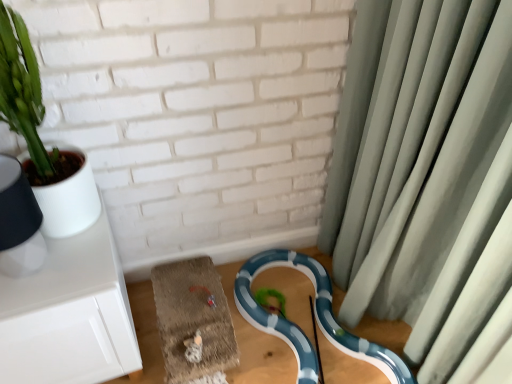
Question: From the image's perspective, does green fabric curtain at right appear higher than blue glossy snake at lower center?

Choices:
 (A) no
 (B) yes

Answer: (B)

Question: Does green fabric curtain at right come in front of blue glossy snake at lower center?

Choices:
 (A) yes
 (B) no

Answer: (A)

Question: Can you confirm if green fabric curtain at right is wider than blue glossy snake at lower center?

Choices:
 (A) yes
 (B) no

Answer: (B)

Question: From a real-world perspective, is green fabric curtain at right over blue glossy snake at lower center?

Choices:
 (A) no
 (B) yes

Answer: (B)

Question: Is green fabric curtain at right shorter than blue glossy snake at lower center?

Choices:
 (A) no
 (B) yes

Answer: (A)

Question: Is the depth of green fabric curtain at right greater than that of blue glossy snake at lower center?

Choices:
 (A) no
 (B) yes

Answer: (A)

Question: Can you confirm if green matte plant at upper left is taller than blue glossy snake at lower center?

Choices:
 (A) yes
 (B) no

Answer: (A)

Question: Is the position of green matte plant at upper left more distant than that of blue glossy snake at lower center?

Choices:
 (A) yes
 (B) no

Answer: (B)

Question: Does green matte plant at upper left have a smaller size compared to blue glossy snake at lower center?

Choices:
 (A) yes
 (B) no

Answer: (B)

Question: Considering the relative sizes of green matte plant at upper left and blue glossy snake at lower center in the image provided, is green matte plant at upper left thinner than blue glossy snake at lower center?

Choices:
 (A) yes
 (B) no

Answer: (A)

Question: Is green matte plant at upper left not inside blue glossy snake at lower center?

Choices:
 (A) yes
 (B) no

Answer: (A)

Question: Is green matte plant at upper left next to blue glossy snake at lower center?

Choices:
 (A) no
 (B) yes

Answer: (A)

Question: Is green matte plant at upper left further to the viewer compared to green fabric curtain at right?

Choices:
 (A) yes
 (B) no

Answer: (A)